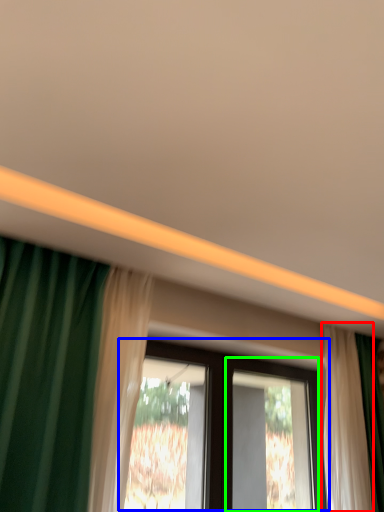
Question: Based on their relative distances, which object is nearer to curtain (highlighted by a red box)? Choose from window (highlighted by a blue box) and screen door (highlighted by a green box).

Choices:
 (A) window
 (B) screen door

Answer: (A)